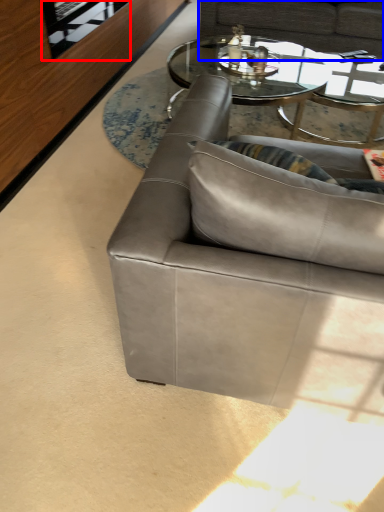
Question: Which of the following is the farthest to the observer, glass door (highlighted by a red box) or studio couch (highlighted by a blue box)?

Choices:
 (A) glass door
 (B) studio couch

Answer: (B)